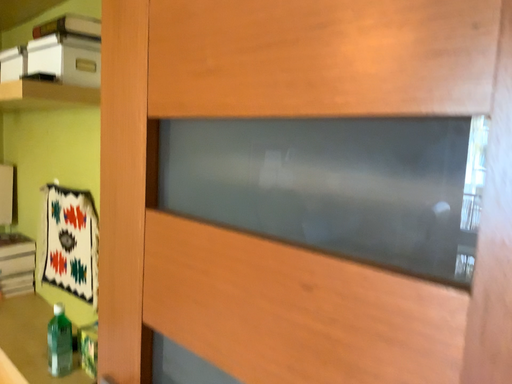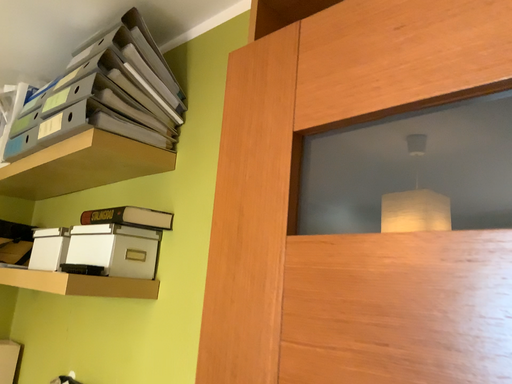
Question: Which way did the camera rotate in the video?

Choices:
 (A) rotated downward
 (B) rotated upward

Answer: (B)